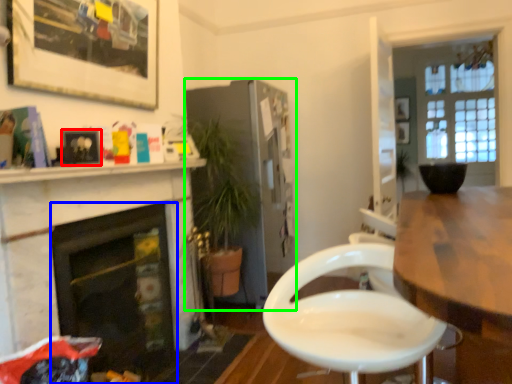
Question: Estimate the real-world distances between objects in this image. Which object is farther from picture frame (highlighted by a red box), fireplace (highlighted by a blue box) or cabinetry (highlighted by a green box)?

Choices:
 (A) fireplace
 (B) cabinetry

Answer: (B)